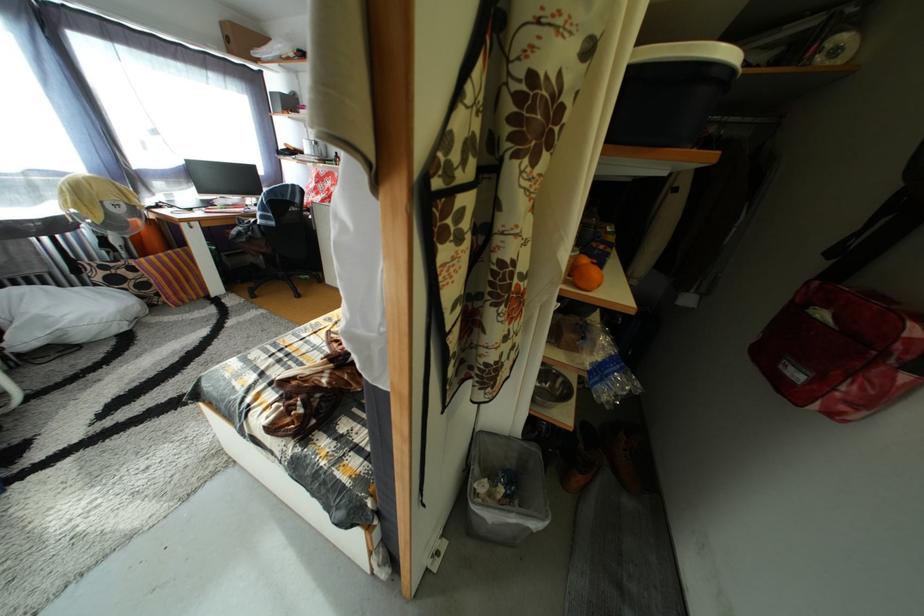
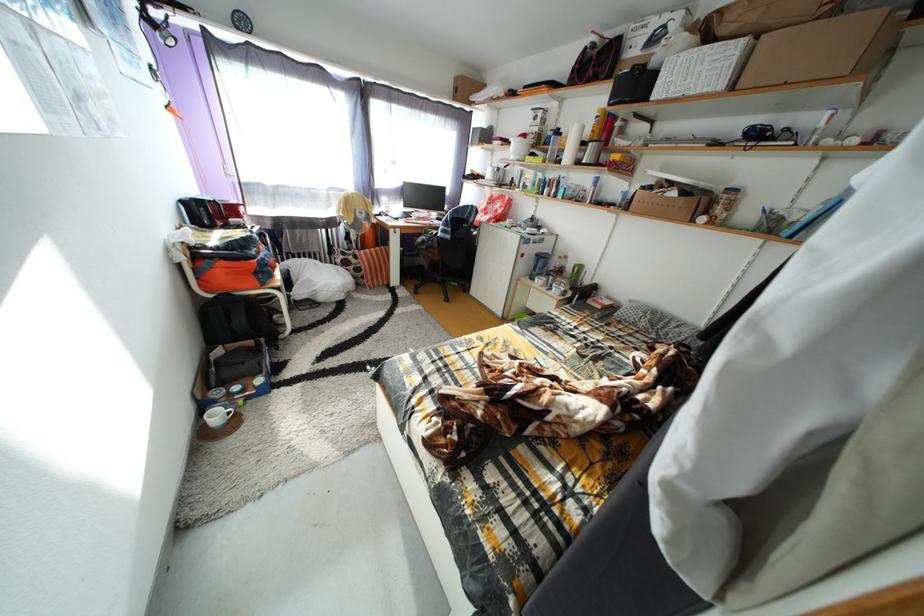
Question: Based on the continuous images, in which direction is the camera rotating? Reply with the corresponding letter.

Choices:
 (A) Left
 (B) Right
 (C) Up
 (D) Down

Answer: (A)